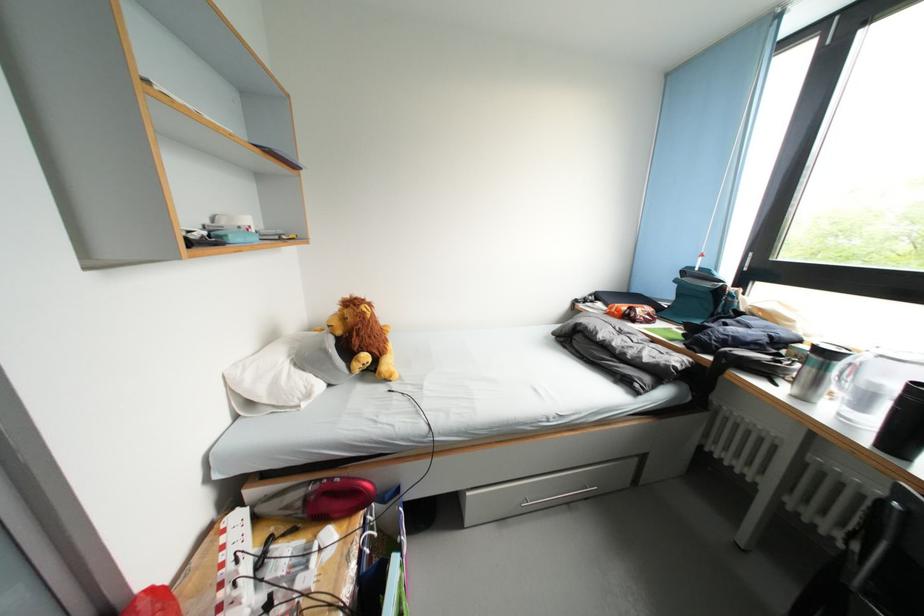
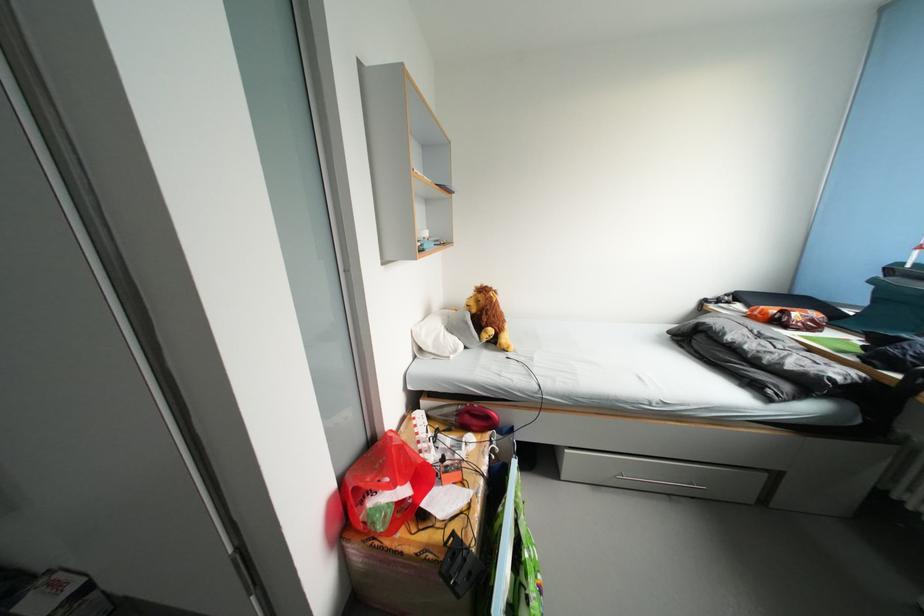
In the second image, find the point that corresponds to pixel 304 370 in the first image.

(456, 334)